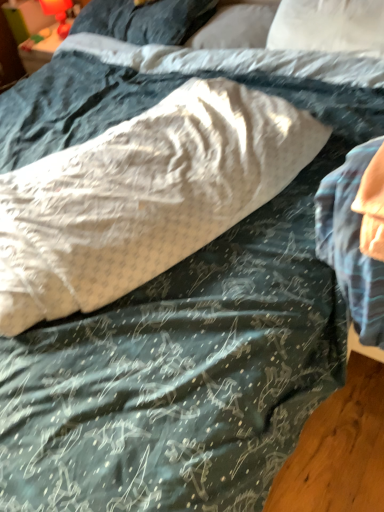
Measure the distance between white soft pillow at upper center, which is the third pillow from top to bottom, and camera.

4.90 feet.

The height and width of the screenshot is (512, 384). Describe the element at coordinates (329, 26) in the screenshot. I see `white soft pillow at upper center, the second pillow in the bottom-to-top sequence` at that location.

The height and width of the screenshot is (512, 384). What do you see at coordinates (145, 20) in the screenshot? I see `soft gray pillow at upper center, placed as the first pillow when sorted from top to bottom` at bounding box center [145, 20].

The width and height of the screenshot is (384, 512). In order to click on white soft pillow at upper center, the second pillow positioned from the top in this screenshot , I will do `click(236, 26)`.

Locate an element on the screen. The width and height of the screenshot is (384, 512). white soft pillow at upper center, which is the third pillow from top to bottom is located at coordinates (329, 26).

Considering the sizes of objects white textured pillow at center, which appears as the fourth pillow when viewed from the top, and white soft pillow at upper center, the second pillow in the bottom-to-top sequence, in the image provided, who is bigger, white textured pillow at center, which appears as the fourth pillow when viewed from the top, or white soft pillow at upper center, the second pillow in the bottom-to-top sequence,?

With larger size is white textured pillow at center, which appears as the fourth pillow when viewed from the top.

From the image's perspective, is white textured pillow at center, arranged as the first pillow when ordered from the bottom, above white soft pillow at upper center, the second pillow in the bottom-to-top sequence?

Actually, white textured pillow at center, arranged as the first pillow when ordered from the bottom, appears below white soft pillow at upper center, the second pillow in the bottom-to-top sequence, in the image.

Which object is positioned more to the left, white textured pillow at center, which appears as the fourth pillow when viewed from the top, or white soft pillow at upper center, the second pillow in the bottom-to-top sequence?

From the viewer's perspective, white textured pillow at center, which appears as the fourth pillow when viewed from the top, appears more on the left side.

Considering the sizes of objects white textured pillow at center, arranged as the first pillow when ordered from the bottom, and white soft pillow at upper center, which is the third pillow from top to bottom, in the image provided, who is shorter, white textured pillow at center, arranged as the first pillow when ordered from the bottom, or white soft pillow at upper center, which is the third pillow from top to bottom,?

white textured pillow at center, arranged as the first pillow when ordered from the bottom.

Is the surface of soft gray pillow at upper center, which is the fourth pillow in bottom-to-top order, in direct contact with white soft pillow at upper center, which appears as the 3th pillow when ordered from the bottom?

No, soft gray pillow at upper center, which is the fourth pillow in bottom-to-top order, is not making contact with white soft pillow at upper center, which appears as the 3th pillow when ordered from the bottom.

Which object is positioned more to the right, soft gray pillow at upper center, placed as the first pillow when sorted from top to bottom, or white soft pillow at upper center, which appears as the 3th pillow when ordered from the bottom?

white soft pillow at upper center, which appears as the 3th pillow when ordered from the bottom.

From the image's perspective, is soft gray pillow at upper center, placed as the first pillow when sorted from top to bottom, above or below white soft pillow at upper center, which appears as the 3th pillow when ordered from the bottom?

soft gray pillow at upper center, placed as the first pillow when sorted from top to bottom, is situated higher than white soft pillow at upper center, which appears as the 3th pillow when ordered from the bottom, in the image.

Which pillow is the 1st one when counting from the front of the soft gray pillow at upper center, placed as the first pillow when sorted from top to bottom? Please provide its 2D coordinates.

[(236, 26)]

From the image's perspective, relative to white textured pillow at center, which appears as the fourth pillow when viewed from the top, is soft gray pillow at upper center, which is the fourth pillow in bottom-to-top order, above or below?

Clearly, from the image's perspective, soft gray pillow at upper center, which is the fourth pillow in bottom-to-top order, is above white textured pillow at center, which appears as the fourth pillow when viewed from the top.

Is soft gray pillow at upper center, placed as the first pillow when sorted from top to bottom, bigger than white textured pillow at center, which appears as the fourth pillow when viewed from the top?

Actually, soft gray pillow at upper center, placed as the first pillow when sorted from top to bottom, might be smaller than white textured pillow at center, which appears as the fourth pillow when viewed from the top.

Does soft gray pillow at upper center, which is the fourth pillow in bottom-to-top order, have a lesser height compared to white textured pillow at center, arranged as the first pillow when ordered from the bottom?

Answer: Indeed, soft gray pillow at upper center, which is the fourth pillow in bottom-to-top order, has a lesser height compared to white textured pillow at center, arranged as the first pillow when ordered from the bottom.

Would you say white textured pillow at center, which appears as the fourth pillow when viewed from the top, is part of soft gray pillow at upper center, placed as the first pillow when sorted from top to bottom,'s contents?

No, white textured pillow at center, which appears as the fourth pillow when viewed from the top, is not a part of soft gray pillow at upper center, placed as the first pillow when sorted from top to bottom.

From a real-world perspective, which is physically above, white soft pillow at upper center, the second pillow in the bottom-to-top sequence, or white soft pillow at upper center, the second pillow positioned from the top?

white soft pillow at upper center, the second pillow in the bottom-to-top sequence, from a real-world perspective.

Consider the image. Considering the sizes of objects white soft pillow at upper center, the second pillow in the bottom-to-top sequence, and white soft pillow at upper center, the second pillow positioned from the top, in the image provided, who is smaller, white soft pillow at upper center, the second pillow in the bottom-to-top sequence, or white soft pillow at upper center, the second pillow positioned from the top,?

Smaller between the two is white soft pillow at upper center, the second pillow positioned from the top.

I want to click on the 3rd pillow below the white soft pillow at upper center, which is the third pillow from top to bottom (from a real-world perspective), so click(x=236, y=26).

Locate an element on the screen. Image resolution: width=384 pixels, height=512 pixels. the 1st pillow to the left when counting from the white soft pillow at upper center, which appears as the 3th pillow when ordered from the bottom is located at coordinates (143, 196).

Are white textured pillow at center, arranged as the first pillow when ordered from the bottom, and white soft pillow at upper center, the second pillow positioned from the top, far apart?

No, white textured pillow at center, arranged as the first pillow when ordered from the bottom, is in close proximity to white soft pillow at upper center, the second pillow positioned from the top.

From a real-world perspective, between white textured pillow at center, arranged as the first pillow when ordered from the bottom, and white soft pillow at upper center, which appears as the 3th pillow when ordered from the bottom, who is vertically higher?

From a 3D spatial view, white textured pillow at center, arranged as the first pillow when ordered from the bottom, is above.

Considering the positions of points (158, 189) and (248, 8), is point (158, 189) closer to camera compared to point (248, 8)?

Yes, it is.

Between white soft pillow at upper center, the second pillow in the bottom-to-top sequence, and soft gray pillow at upper center, placed as the first pillow when sorted from top to bottom, which one has larger size?

soft gray pillow at upper center, placed as the first pillow when sorted from top to bottom, is bigger.

Is soft gray pillow at upper center, placed as the first pillow when sorted from top to bottom, a part of white soft pillow at upper center, which is the third pillow from top to bottom?

Actually, soft gray pillow at upper center, placed as the first pillow when sorted from top to bottom, is outside white soft pillow at upper center, which is the third pillow from top to bottom.

From a real-world perspective, which is physically below, white soft pillow at upper center, the second pillow in the bottom-to-top sequence, or soft gray pillow at upper center, placed as the first pillow when sorted from top to bottom?

In real-world perspective, soft gray pillow at upper center, placed as the first pillow when sorted from top to bottom, is lower.

Is white soft pillow at upper center, which is the third pillow from top to bottom, far from soft gray pillow at upper center, which is the fourth pillow in bottom-to-top order?

Actually, white soft pillow at upper center, which is the third pillow from top to bottom, and soft gray pillow at upper center, which is the fourth pillow in bottom-to-top order, are a little close together.

Which is in front, point (244, 2) or point (204, 19)?

The point (244, 2) is more forward.

Consider the image. From the image's perspective, does white soft pillow at upper center, the second pillow positioned from the top, appear lower than soft gray pillow at upper center, placed as the first pillow when sorted from top to bottom?

Correct, white soft pillow at upper center, the second pillow positioned from the top, appears lower than soft gray pillow at upper center, placed as the first pillow when sorted from top to bottom, in the image.

Which object is wider, white soft pillow at upper center, the second pillow positioned from the top, or soft gray pillow at upper center, which is the fourth pillow in bottom-to-top order?

soft gray pillow at upper center, which is the fourth pillow in bottom-to-top order.

This screenshot has height=512, width=384. I want to click on pillow above the white textured pillow at center, which appears as the fourth pillow when viewed from the top (from a real-world perspective), so click(x=329, y=26).

The width and height of the screenshot is (384, 512). Identify the location of the 1st pillow below the soft gray pillow at upper center, which is the fourth pillow in bottom-to-top order (from the image's perspective). (236, 26).

Looking at the image, which one is located further to white textured pillow at center, which appears as the fourth pillow when viewed from the top, soft gray pillow at upper center, which is the fourth pillow in bottom-to-top order, or white soft pillow at upper center, the second pillow in the bottom-to-top sequence?

Based on the image, soft gray pillow at upper center, which is the fourth pillow in bottom-to-top order, appears to be further to white textured pillow at center, which appears as the fourth pillow when viewed from the top.

Based on their spatial positions, is white soft pillow at upper center, which is the third pillow from top to bottom, or soft gray pillow at upper center, placed as the first pillow when sorted from top to bottom, further from white soft pillow at upper center, the second pillow positioned from the top?

Among the two, white soft pillow at upper center, which is the third pillow from top to bottom, is located further to white soft pillow at upper center, the second pillow positioned from the top.

Based on their spatial positions, is white soft pillow at upper center, which appears as the 3th pillow when ordered from the bottom, or white textured pillow at center, which appears as the fourth pillow when viewed from the top, further from soft gray pillow at upper center, placed as the first pillow when sorted from top to bottom?

white textured pillow at center, which appears as the fourth pillow when viewed from the top.

When comparing their distances from white soft pillow at upper center, which is the third pillow from top to bottom, does white soft pillow at upper center, which appears as the 3th pillow when ordered from the bottom, or white textured pillow at center, arranged as the first pillow when ordered from the bottom, seem closer?

Among the two, white soft pillow at upper center, which appears as the 3th pillow when ordered from the bottom, is located nearer to white soft pillow at upper center, which is the third pillow from top to bottom.

Estimate the real-world distances between objects in this image. Which object is closer to white soft pillow at upper center, the second pillow positioned from the top, white textured pillow at center, arranged as the first pillow when ordered from the bottom, or soft gray pillow at upper center, which is the fourth pillow in bottom-to-top order?

Among the two, soft gray pillow at upper center, which is the fourth pillow in bottom-to-top order, is located nearer to white soft pillow at upper center, the second pillow positioned from the top.

When comparing their distances from white soft pillow at upper center, the second pillow positioned from the top, does soft gray pillow at upper center, which is the fourth pillow in bottom-to-top order, or white soft pillow at upper center, which is the third pillow from top to bottom, seem further?

Based on the image, white soft pillow at upper center, which is the third pillow from top to bottom, appears to be further to white soft pillow at upper center, the second pillow positioned from the top.

When comparing their distances from white soft pillow at upper center, which appears as the 3th pillow when ordered from the bottom, does soft gray pillow at upper center, which is the fourth pillow in bottom-to-top order, or white textured pillow at center, arranged as the first pillow when ordered from the bottom, seem further?

white textured pillow at center, arranged as the first pillow when ordered from the bottom, is further to white soft pillow at upper center, which appears as the 3th pillow when ordered from the bottom.

Based on their spatial positions, is white soft pillow at upper center, the second pillow positioned from the top, or soft gray pillow at upper center, which is the fourth pillow in bottom-to-top order, closer to white soft pillow at upper center, the second pillow in the bottom-to-top sequence?

white soft pillow at upper center, the second pillow positioned from the top, is closer to white soft pillow at upper center, the second pillow in the bottom-to-top sequence.

Locate an element on the screen. pillow between white textured pillow at center, which appears as the fourth pillow when viewed from the top, and white soft pillow at upper center, which appears as the 3th pillow when ordered from the bottom, from front to back is located at coordinates (329, 26).